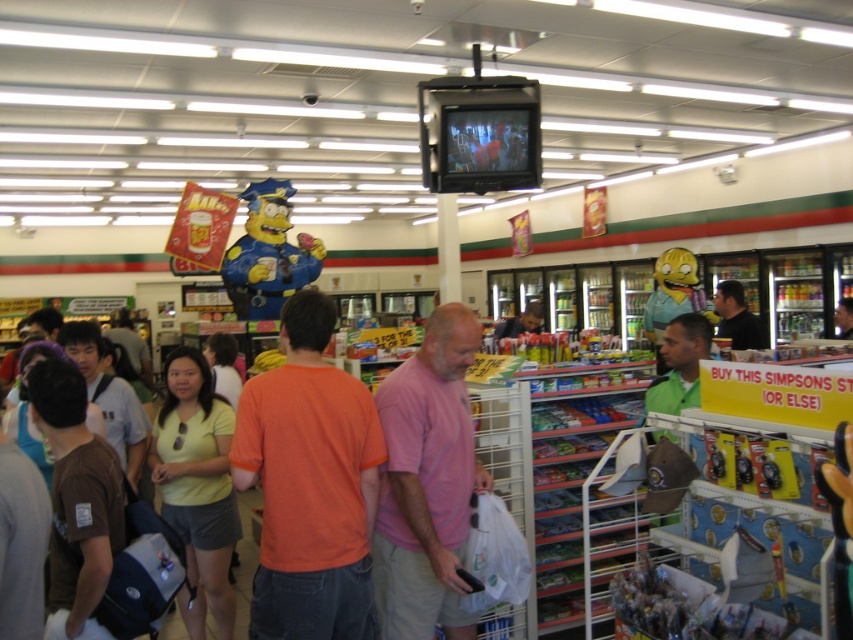
Question: Is orange cotton t-shirt at center above yellow matte shirt at lower left?

Choices:
 (A) no
 (B) yes

Answer: (B)

Question: Can you confirm if orange cotton t-shirt at center is positioned to the right of blue painted cardboard simpson at center?

Choices:
 (A) yes
 (B) no

Answer: (A)

Question: Among these objects, which one is nearest to the camera?

Choices:
 (A) pink cotton shirt at center
 (B) yellow fabric homer simpson at center
 (C) blue painted cardboard simpson at center

Answer: (A)

Question: Is orange cotton t-shirt at center wider than blue painted cardboard simpson at center?

Choices:
 (A) yes
 (B) no

Answer: (B)

Question: Estimate the real-world distances between objects in this image. Which object is closer to the yellow matte shirt at lower left?

Choices:
 (A) yellow fabric homer simpson at center
 (B) blue painted cardboard simpson at center
 (C) orange cotton t-shirt at center

Answer: (C)

Question: Which of the following is the farthest from the observer?

Choices:
 (A) (198, 397)
 (B) (376, 557)

Answer: (A)